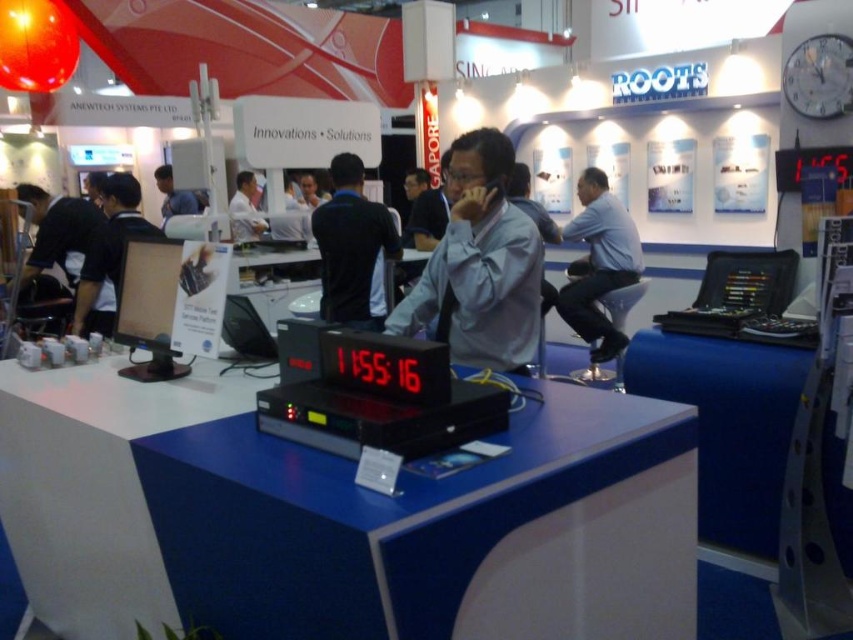
You are a photographer at the exhibition and want to capture a clear photo of the white plastic clock at upper right. However, the light blue shirt at center is blocking your view. Can you suggest a way to adjust your position to avoid the obstruction?

The light blue shirt at center is larger in size than the white plastic clock at upper right, so moving your camera position slightly to the left or right might help avoid the obstruction caused by the larger shirt.

You are a photographer at the exhibition. You want to take a photo of the gray matte shirt at center and the white plastic clock at upper right. Which object will appear larger in the photo?

The gray matte shirt at center will appear larger in the photo because it is closer to the viewer than the white plastic clock at upper right.

You are a photographer at the exhibition and want to capture both the light blue shirt at center and the white plastic clock at upper right in the same frame. Which object should you focus on first to ensure both are in focus?

The light blue shirt at center is much taller than the white plastic clock at upper right, so focusing on the shirt first will help ensure both are in focus since it is larger and closer to the camera.